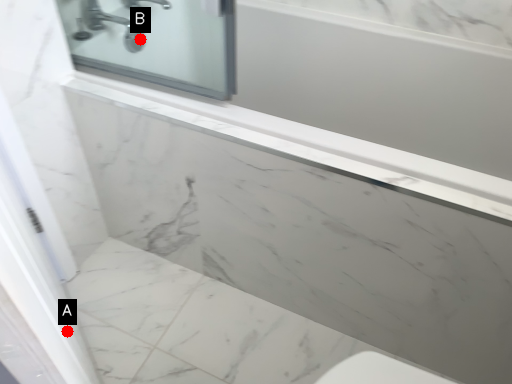
Question: Two points are circled on the image, labeled by A and B beside each circle. Among these points, which one is farthest from the camera?

Choices:
 (A) A is further
 (B) B is further

Answer: (B)